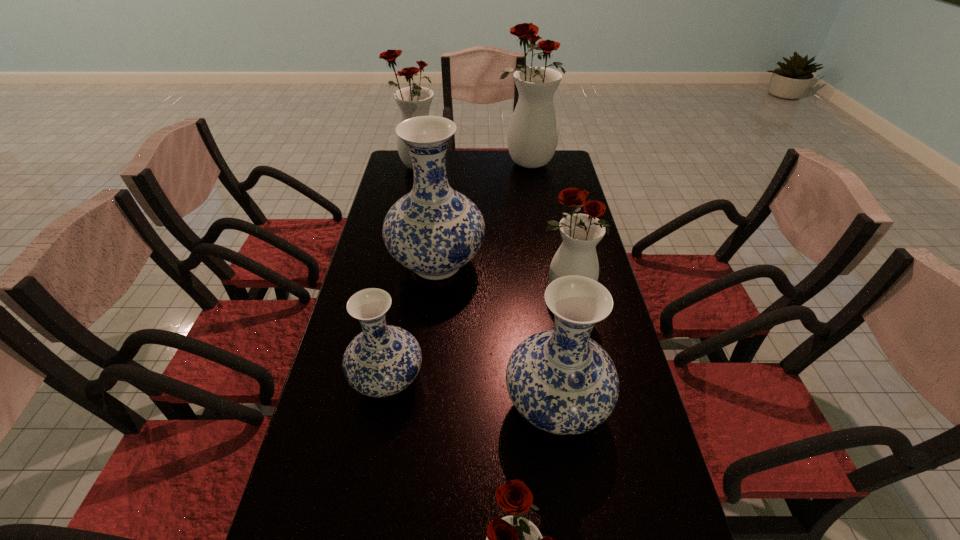
Find the location of a particular element. the biggest red vase is located at coordinates (532, 137).

Find the location of a particular element. the tallest object is located at coordinates (532, 137).

Identify the location of the third smallest red vase. (415, 101).

Where is `the biggest blue vase`? This screenshot has height=540, width=960. the biggest blue vase is located at coordinates (433, 230).

The width and height of the screenshot is (960, 540). What are the coordinates of `the third biggest red vase` in the screenshot? It's located at (577, 255).

I want to click on the rightmost blue vase, so click(560, 380).

At what (x,y) coordinates should I click in order to perform the action: click on the smallest blue vase. Please return your answer as a coordinate pair (x, y). The image size is (960, 540). Looking at the image, I should click on (381, 361).

At what (x,y) coordinates should I click in order to perform the action: click on blank space located on the left of the biggest red vase. Please return your answer as a coordinate pair (x, y). Looking at the image, I should click on (485, 163).

Locate an element on the screen. The height and width of the screenshot is (540, 960). free spot located on the front of the third smallest red vase is located at coordinates (404, 229).

Locate an element on the screen. The height and width of the screenshot is (540, 960). vacant space situated 0.070m on the front of the biggest blue vase is located at coordinates (432, 316).